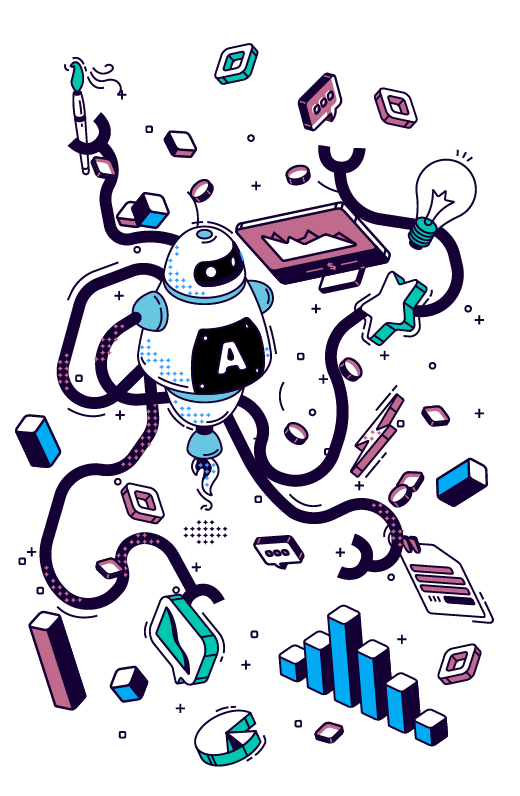
This screenshot has width=520, height=796. Find the location of `lightbulb`. lightbulb is located at coordinates (442, 209).